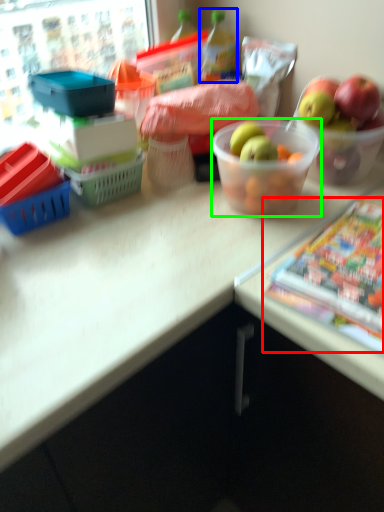
Question: Estimate the real-world distances between objects in this image. Which object is closer to comic book (highlighted by a red box), bottle (highlighted by a blue box) or bowl (highlighted by a green box)?

Choices:
 (A) bottle
 (B) bowl

Answer: (B)